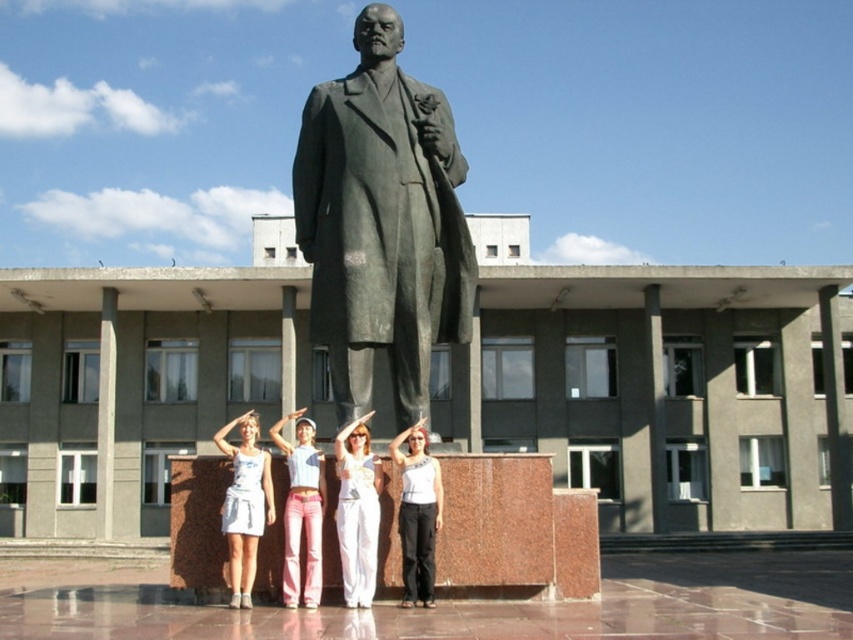
Does white cotton pants at center have a greater height compared to pink denim jeans at center?

No.

Is point (351, 506) closer to camera compared to point (292, 506)?

That is True.

Image resolution: width=853 pixels, height=640 pixels. Find the location of `white cotton pants at center`. white cotton pants at center is located at coordinates (357, 512).

Is white cotton tank top at center closer to the viewer compared to pink denim jeans at center?

No, white cotton tank top at center is behind pink denim jeans at center.

Between white cotton tank top at center and pink denim jeans at center, which one appears on the left side from the viewer's perspective?

white cotton tank top at center is more to the left.

You are a GUI agent. You are given a task and a screenshot of the screen. Output one action in this format:
    pyautogui.click(x=<x>, y=<y>)
    Task: Click on the white cotton tank top at center
    This screenshot has width=853, height=640.
    Given the screenshot: What is the action you would take?
    pyautogui.click(x=245, y=504)

Based on the photo, can you confirm if bronze statue at center is smaller than pink denim jeans at center?

No, bronze statue at center is not smaller than pink denim jeans at center.

Is point (416, 294) closer to camera compared to point (291, 474)?

No, it is behind (291, 474).

Does point (425, 360) come in front of point (291, 449)?

That is False.

Find the location of a particular element. bronze statue at center is located at coordinates (381, 224).